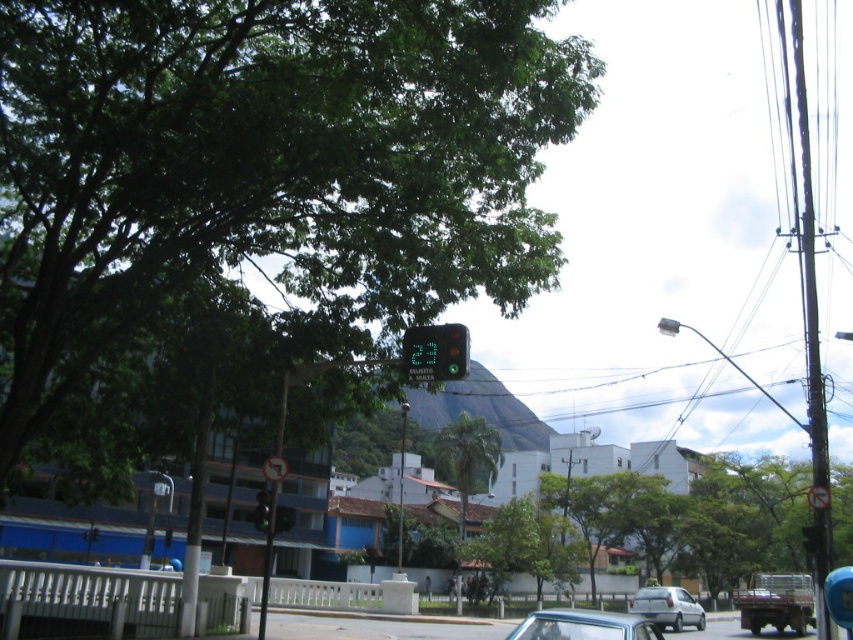
Question: Which object appears closest to the camera in this image?

Choices:
 (A) white plastic sign at upper center
 (B) green leafy tree at center
 (C) green glass traffic light at upper center

Answer: (B)

Question: Is green leafy tree at upper left positioned behind silver metallic car at lower right?

Choices:
 (A) yes
 (B) no

Answer: (B)

Question: Which of these objects is positioned closest to the green matte traffic light at center?

Choices:
 (A) green leafy tree at upper left
 (B) rustic metal truck at lower right

Answer: (A)

Question: Which point is farther to the camera?

Choices:
 (A) (636, 592)
 (B) (256, 499)
 (C) (444, 355)
 (D) (770, 573)

Answer: (A)

Question: Can you confirm if green leafy tree at center is bigger than white plastic sign at upper center?

Choices:
 (A) yes
 (B) no

Answer: (A)

Question: Is white plastic sign at upper center below green glass traffic light at upper center?

Choices:
 (A) yes
 (B) no

Answer: (B)